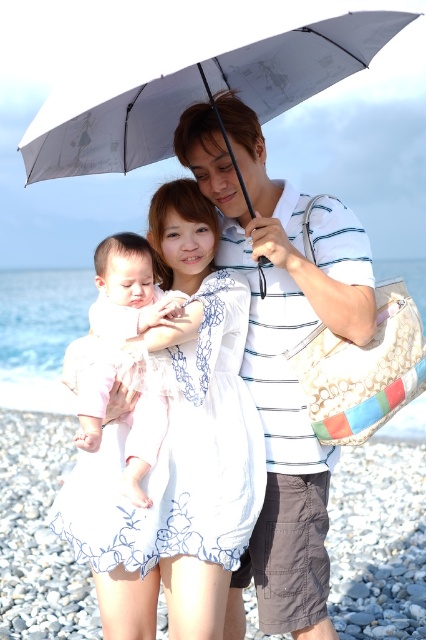
Locate an element on the screen. This screenshot has width=426, height=640. white striped polo shirt at center is located at coordinates (282, 355).

Does white striped polo shirt at center have a greater height compared to light pink fabric baby at center?

Yes, white striped polo shirt at center is taller than light pink fabric baby at center.

This screenshot has width=426, height=640. In order to click on white striped polo shirt at center in this screenshot , I will do `click(282, 355)`.

This screenshot has height=640, width=426. Find the location of `white striped polo shirt at center`. white striped polo shirt at center is located at coordinates (282, 355).

Can you confirm if white embroidered dress at center is smaller than white striped polo shirt at center?

Yes.

Is white embroidered dress at center positioned behind white striped polo shirt at center?

No, white embroidered dress at center is closer to the viewer.

Which is in front, point (250, 502) or point (359, 314)?

Point (359, 314)

I want to click on white embroidered dress at center, so click(178, 451).

Does white embroidered dress at center appear on the left side of light pink fabric baby at center?

Incorrect, white embroidered dress at center is not on the left side of light pink fabric baby at center.

Describe the element at coordinates (178, 451) in the screenshot. I see `white embroidered dress at center` at that location.

Is point (196, 445) less distant than point (129, 244)?

Yes, point (196, 445) is closer to viewer.

Where is `white embroidered dress at center`? The width and height of the screenshot is (426, 640). white embroidered dress at center is located at coordinates (178, 451).